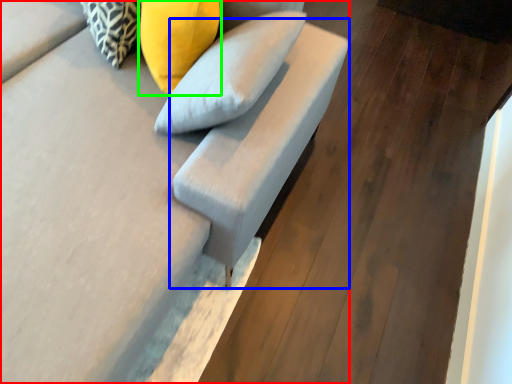
Question: Which is farther away from furniture (highlighted by a red box)? armchair (highlighted by a blue box) or pillow (highlighted by a green box)?

Choices:
 (A) armchair
 (B) pillow

Answer: (B)